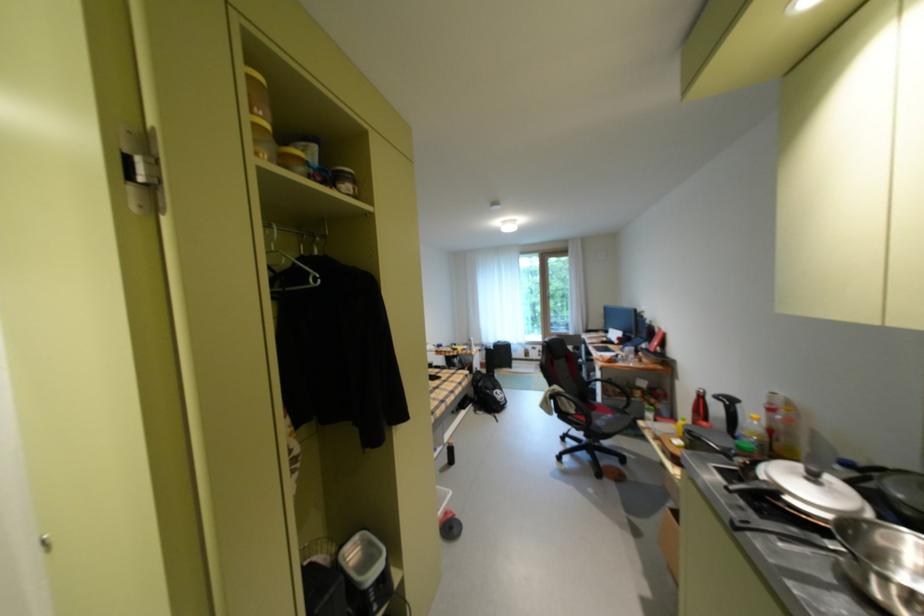
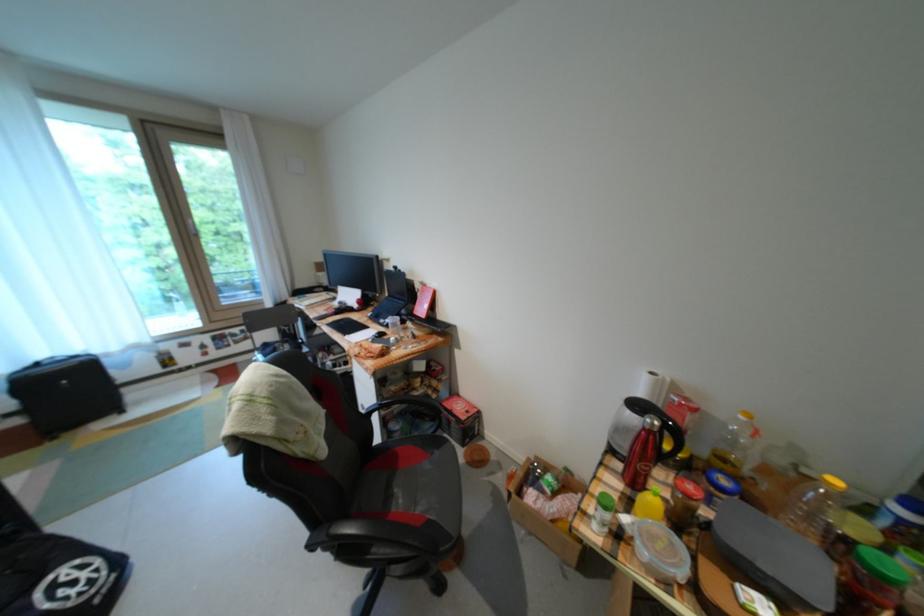
Locate, in the second image, the point that corresponds to [711,402] in the first image.

(662, 438)